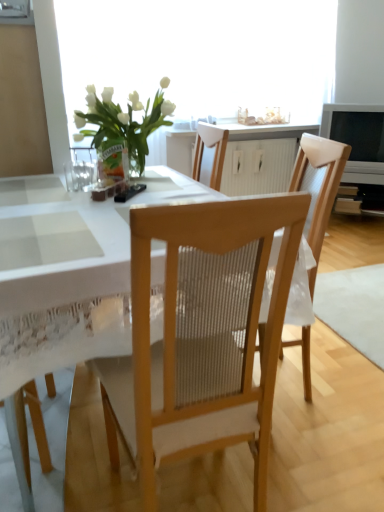
Locate an element on the screen. The image size is (384, 512). free point to the left of clear glass vase at center is located at coordinates (82, 182).